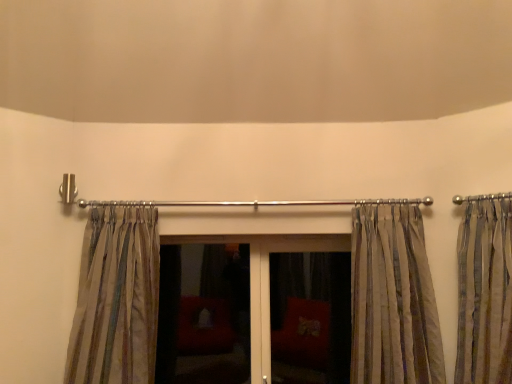
Question: Is matte glass screen door at center, the 1th screen door in the right-to-left sequence, facing away from silky beige curtain at left, acting as the 3th curtain starting from the right?

Choices:
 (A) no
 (B) yes

Answer: (A)

Question: Considering the relative positions of matte glass screen door at center, the 1th screen door in the right-to-left sequence, and silky beige curtain at left, acting as the 3th curtain starting from the right, in the image provided, is matte glass screen door at center, the 1th screen door in the right-to-left sequence, in front of silky beige curtain at left, acting as the 3th curtain starting from the right,?

Choices:
 (A) no
 (B) yes

Answer: (A)

Question: From a real-world perspective, is matte glass screen door at center, which ranks as the 2th screen door in left-to-right order, on top of silky beige curtain at left, which is counted as the first curtain, starting from the left?

Choices:
 (A) no
 (B) yes

Answer: (A)

Question: Are matte glass screen door at center, the 1th screen door in the right-to-left sequence, and silky beige curtain at left, acting as the 3th curtain starting from the right, far apart?

Choices:
 (A) yes
 (B) no

Answer: (A)

Question: Is matte glass screen door at center, the 1th screen door in the right-to-left sequence, oriented towards silky beige curtain at left, which is counted as the first curtain, starting from the left?

Choices:
 (A) no
 (B) yes

Answer: (A)

Question: Considering the positions of striped fabric curtain at center, which is the 2th curtain in right-to-left order, and matte glass screen door at center, marked as the second screen door in a right-to-left arrangement, in the image, is striped fabric curtain at center, which is the 2th curtain in right-to-left order, taller or shorter than matte glass screen door at center, marked as the second screen door in a right-to-left arrangement,?

Choices:
 (A) short
 (B) tall

Answer: (B)

Question: In the image, is striped fabric curtain at center, which is the 2th curtain in left-to-right order, on the left side or the right side of matte glass screen door at center, marked as the second screen door in a right-to-left arrangement?

Choices:
 (A) left
 (B) right

Answer: (B)

Question: Considering the positions of point click(x=388, y=347) and point click(x=182, y=292), is point click(x=388, y=347) closer or farther from the camera than point click(x=182, y=292)?

Choices:
 (A) closer
 (B) farther

Answer: (A)

Question: From the image's perspective, is striped fabric curtain at center, which is the 2th curtain in right-to-left order, above or below matte glass screen door at center, marked as the second screen door in a right-to-left arrangement?

Choices:
 (A) above
 (B) below

Answer: (A)

Question: Is silky beige curtains at right, which is the first curtain from right to left, taller or shorter than matte glass door at center?

Choices:
 (A) tall
 (B) short

Answer: (A)

Question: In the image, is silky beige curtains at right, which is the first curtain from right to left, positioned in front of or behind matte glass door at center?

Choices:
 (A) front
 (B) behind

Answer: (A)

Question: Looking at their shapes, would you say silky beige curtains at right, the 3th curtain viewed from the left, is wider or thinner than matte glass door at center?

Choices:
 (A) thin
 (B) wide

Answer: (B)

Question: From a real-world perspective, is silky beige curtains at right, which is the first curtain from right to left, above or below matte glass door at center?

Choices:
 (A) above
 (B) below

Answer: (A)

Question: Is point (297, 240) positioned closer to the camera than point (463, 221)?

Choices:
 (A) closer
 (B) farther

Answer: (B)

Question: From the image's perspective, is matte glass door at center positioned above or below silky beige curtains at right, the 3th curtain viewed from the left?

Choices:
 (A) above
 (B) below

Answer: (B)